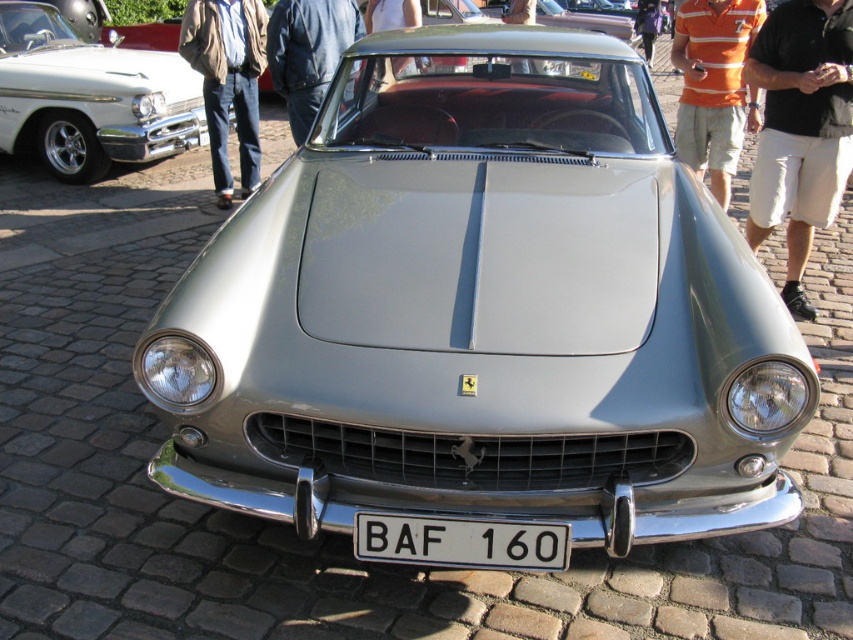
You are standing in front of the Ferrari sports car and notice two items at the center of the scene. Which item is nearer to you, the dark blue leather jacket at center or the light blue fabric pants at center?

The dark blue leather jacket at center is closer to the viewer than the light blue fabric pants at center.

You are a fashion designer observing a classic Ferrari sports car at an exhibition. You notice an orange striped polo shirt at upper center and a dark blue leather jacket at center. Which clothing item is positioned more to the right side of the car?

The orange striped polo shirt at upper center is positioned more to the right side of the car compared to the dark blue leather jacket at center.